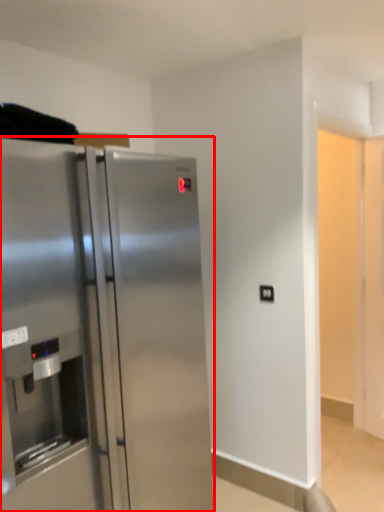
Question: From the image's perspective, considering the relative positions of refrigerator (annotated by the red box) and electric outlet in the image provided, where is refrigerator (annotated by the red box) located with respect to the staircase?

Choices:
 (A) above
 (B) below

Answer: (B)